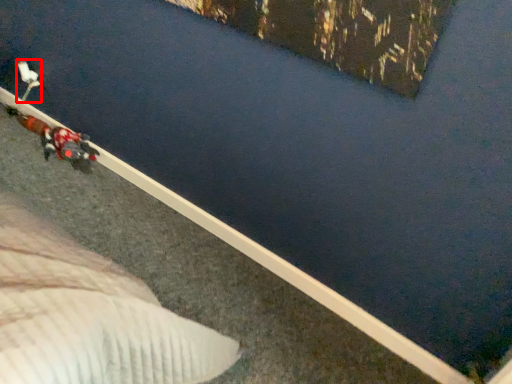
Question: In this image, where is toy (annotated by the red box) located relative to person?

Choices:
 (A) left
 (B) right

Answer: (A)